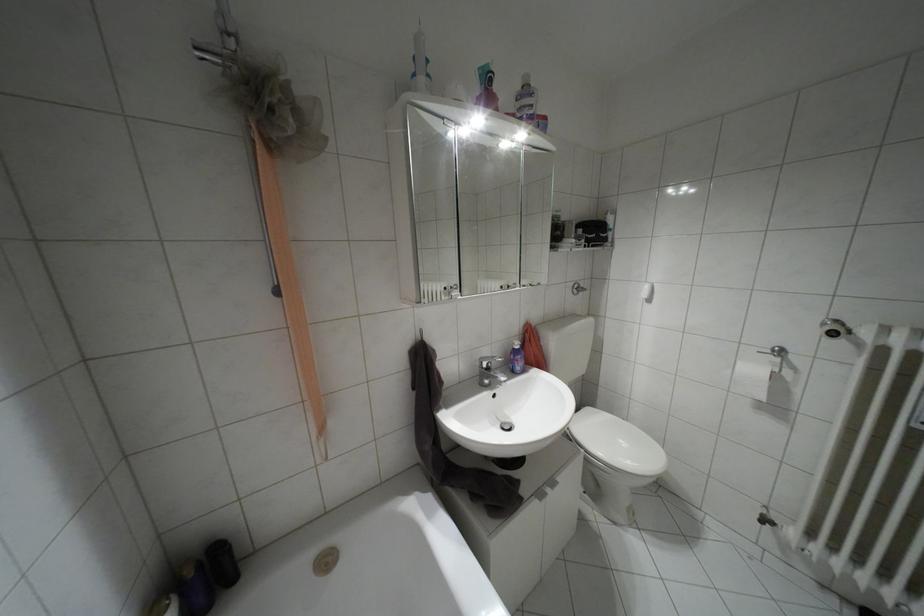
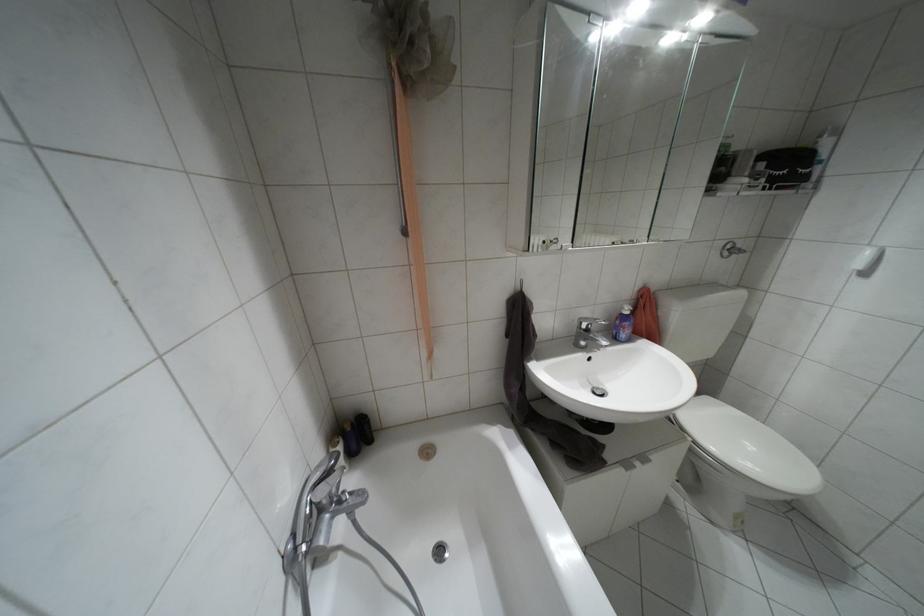
Locate, in the second image, the point that corresponds to [574,292] in the first image.

(723, 254)